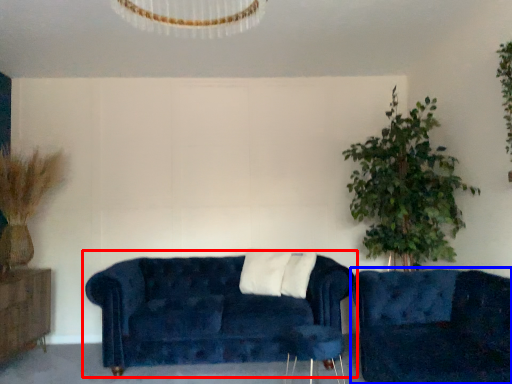
Question: Which point is closer to the camera, studio couch (highlighted by a red box) or studio couch (highlighted by a blue box)?

Choices:
 (A) studio couch
 (B) studio couch

Answer: (B)